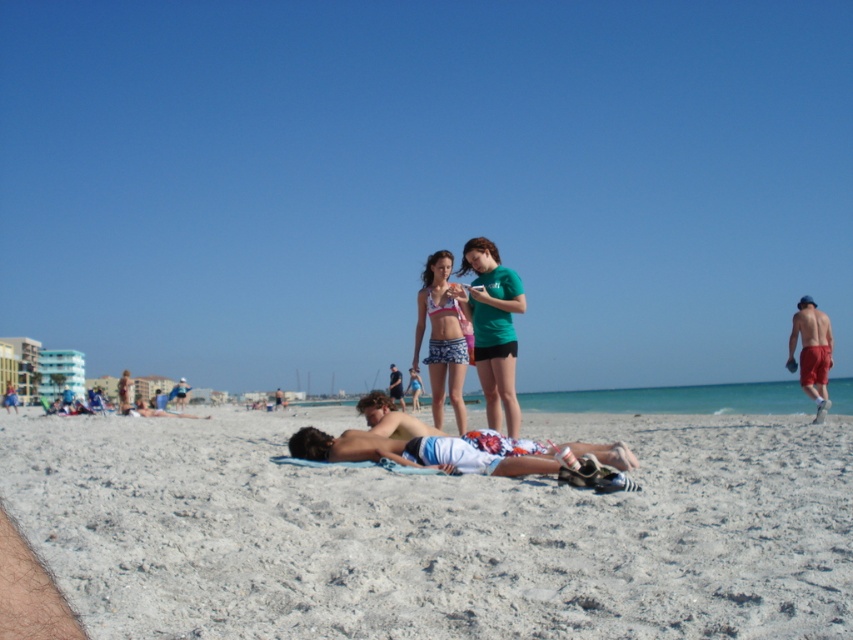
Question: From the image, what is the correct spatial relationship of white sandy beach at center in relation to blue denim shorts at lower left?

Choices:
 (A) right
 (B) left

Answer: (A)

Question: Is smooth tan skin at center bigger than blue denim shorts at lower left?

Choices:
 (A) yes
 (B) no

Answer: (B)

Question: Which is farther from the tan skin man at lower left?

Choices:
 (A) smooth tan skin at center
 (B) tan skin man at center

Answer: (A)

Question: Which object is farther from the camera taking this photo?

Choices:
 (A) green matte t-shirt at center
 (B) tan skin man at lower left

Answer: (B)

Question: Estimate the real-world distances between objects in this image. Which object is closer to the tan skin man at lower left?

Choices:
 (A) blue denim shorts at lower left
 (B) red fabric shorts at right

Answer: (A)

Question: Is green matte t-shirt at center behind blue denim shorts at lower left?

Choices:
 (A) yes
 (B) no

Answer: (B)